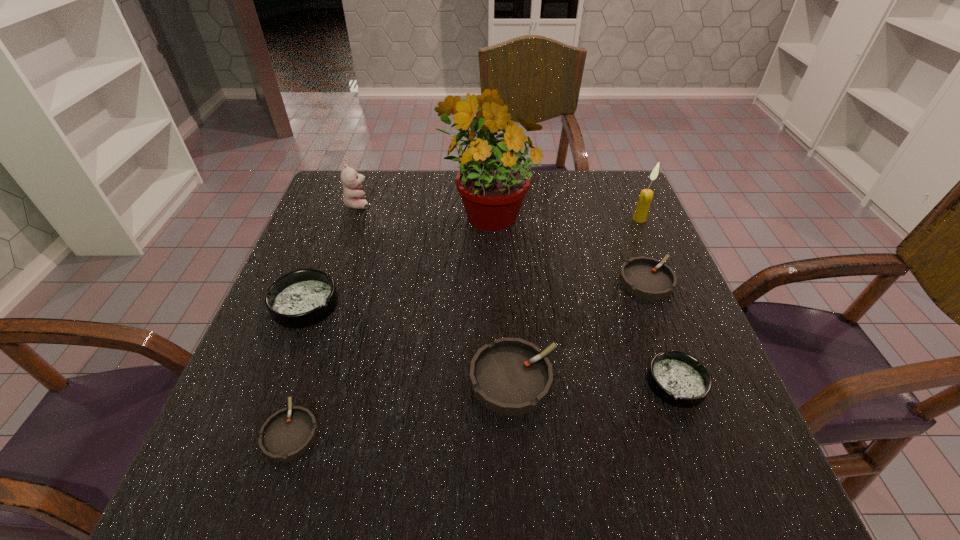
This screenshot has height=540, width=960. I want to click on object that is at the far left corner, so click(x=353, y=197).

Locate an element on the screen. The height and width of the screenshot is (540, 960). object that is at the near left corner is located at coordinates (287, 434).

The height and width of the screenshot is (540, 960). What are the coordinates of `object positioned at the far right corner` in the screenshot? It's located at point(646,195).

Identify the location of vacant area at the far edge of the desktop. This screenshot has width=960, height=540. (391, 176).

Locate an element on the screen. This screenshot has width=960, height=540. free space at the near edge is located at coordinates (366, 454).

The image size is (960, 540). I want to click on free region at the left edge of the desktop, so click(308, 396).

I want to click on vacant space at the right edge of the desktop, so click(688, 346).

You are a GUI agent. You are given a task and a screenshot of the screen. Output one action in this format:
    pyautogui.click(x=<x>, y=<y>)
    Task: Click on the vacant space at the near right corner of the desktop
    This screenshot has width=960, height=540.
    Given the screenshot: What is the action you would take?
    pyautogui.click(x=664, y=468)

Where is `free space between the farther dark ashtray and the teddy bear`? This screenshot has height=540, width=960. free space between the farther dark ashtray and the teddy bear is located at coordinates (331, 254).

Where is `free spot between the shortest ashtray and the rightmost gray ashtray`? The width and height of the screenshot is (960, 540). free spot between the shortest ashtray and the rightmost gray ashtray is located at coordinates (468, 356).